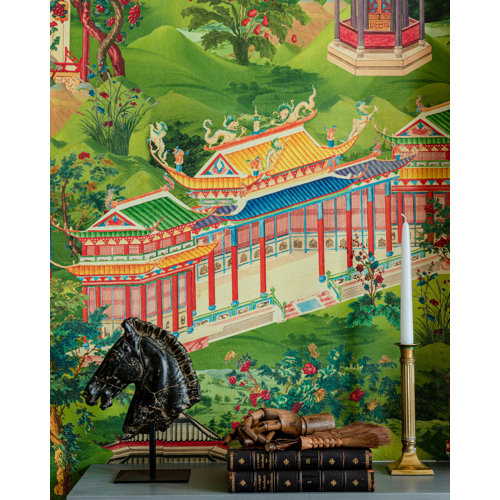
Identify the location of gold colored candlestick. (408, 402).